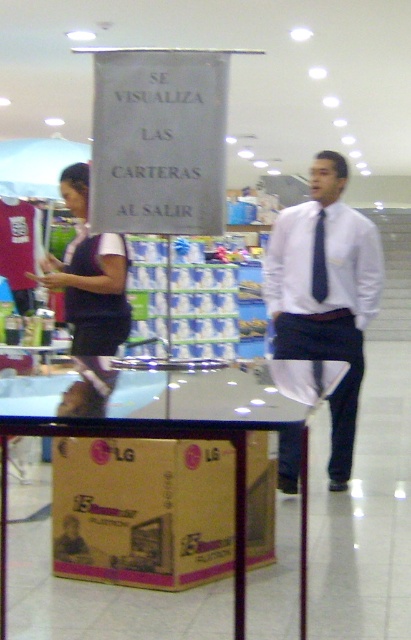
Question: Which of the following is the closest to the observer?

Choices:
 (A) gold cardboard lg tv box at center
 (B) white satin dress shirt at center
 (C) white shirt at center
 (D) black silk tie at center

Answer: (A)

Question: Which object is the farthest from the white shirt at center?

Choices:
 (A) black silk tie at center
 (B) gold cardboard lg tv box at center
 (C) white satin dress shirt at center

Answer: (B)

Question: Is white shirt at center wider than black silk tie at center?

Choices:
 (A) no
 (B) yes

Answer: (B)

Question: In this image, where is white satin dress shirt at center located relative to black silk tie at center?

Choices:
 (A) above
 (B) below

Answer: (B)

Question: Is gold cardboard lg tv box at center to the left of white shirt at center from the viewer's perspective?

Choices:
 (A) no
 (B) yes

Answer: (B)

Question: Among these objects, which one is nearest to the camera?

Choices:
 (A) white shirt at center
 (B) gold cardboard lg tv box at center
 (C) black silk tie at center

Answer: (B)